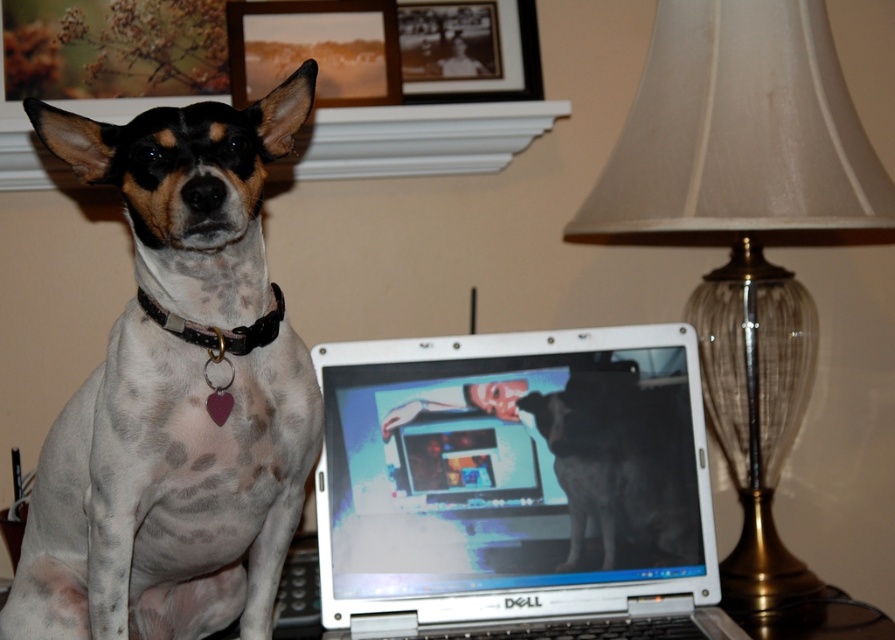
Between point (354, 520) and point (246, 179), which one is positioned behind?

The point (354, 520) is behind.

Who is more forward, (542,428) or (134,337)?

Point (134,337)

Locate an element on the screen. The width and height of the screenshot is (895, 640). white plastic laptop at center is located at coordinates (516, 484).

Locate an element on the screen. white plastic laptop at center is located at coordinates (516, 484).

Is speckled fur dog at left thinner than translucent glass lampshade at upper center?

Yes, speckled fur dog at left is thinner than translucent glass lampshade at upper center.

Between speckled fur dog at left and translucent glass lampshade at upper center, which one has less height?

speckled fur dog at left is shorter.

I want to click on speckled fur dog at left, so click(x=175, y=394).

How far apart are translucent glass lampshade at upper center and black fur dog at center?

translucent glass lampshade at upper center is 10.30 inches away from black fur dog at center.

Which is more to the right, translucent glass lampshade at upper center or black fur dog at center?

Positioned to the right is translucent glass lampshade at upper center.

Is point (816, 186) positioned in front of point (625, 461)?

That is True.

This screenshot has width=895, height=640. I want to click on translucent glass lampshade at upper center, so click(744, 212).